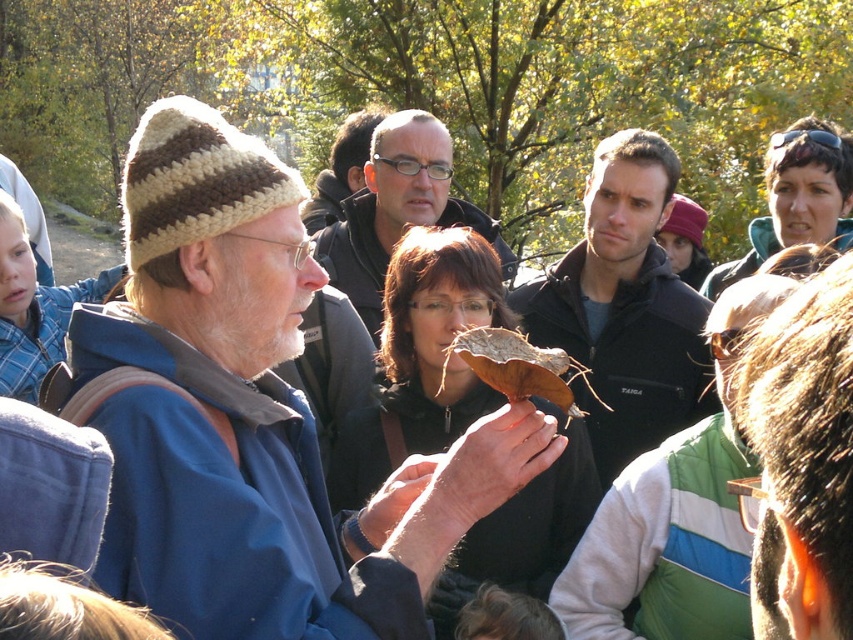
Is point (556, 328) closer to viewer compared to point (386, 237)?

Yes, it is.

Which is in front, point (606, 435) or point (375, 330)?

Positioned in front is point (606, 435).

Identify the location of dark brown leather jacket at center. This screenshot has height=640, width=853. (624, 307).

Who is more forward, (280, 429) or (480, 346)?

Positioned in front is point (480, 346).

Is knitted wool hat at left below brown rough bark at center?

Actually, knitted wool hat at left is above brown rough bark at center.

Is point (271, 230) behind point (514, 348)?

Yes, point (271, 230) is farther from viewer.

I want to click on knitted wool hat at left, so click(x=254, y=417).

In the scene shown: Who is more forward, (405, 193) or (515, 388)?

Point (515, 388)

Where is `matte black jacket at center`? This screenshot has width=853, height=640. matte black jacket at center is located at coordinates (397, 211).